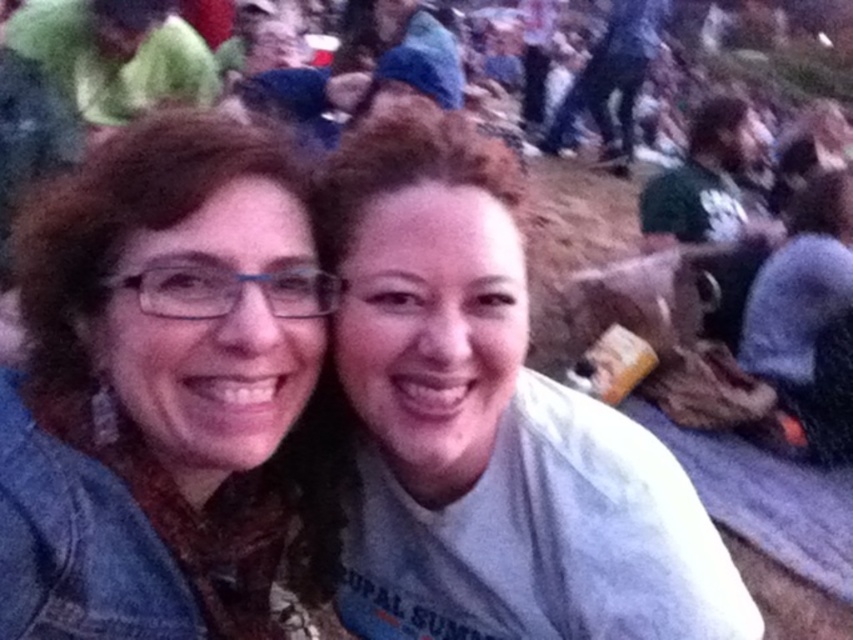
Question: Among these points, which one is farthest from the camera?

Choices:
 (A) (378, 387)
 (B) (117, 93)
 (C) (132, 609)

Answer: (B)

Question: Is matte blue jacket at left bigger than gray cotton shirt at center?

Choices:
 (A) no
 (B) yes

Answer: (A)

Question: Which object is the farthest from the gray cotton shirt at center?

Choices:
 (A) green fabric at upper left
 (B) matte blue jacket at left

Answer: (A)

Question: Which of these objects is positioned farthest from the gray cotton shirt at center?

Choices:
 (A) matte blue jacket at left
 (B) green fabric at upper left

Answer: (B)

Question: Does matte blue jacket at left lie behind green fabric at upper left?

Choices:
 (A) no
 (B) yes

Answer: (A)

Question: Is gray cotton shirt at center to the left of green fabric at upper left from the viewer's perspective?

Choices:
 (A) yes
 (B) no

Answer: (B)